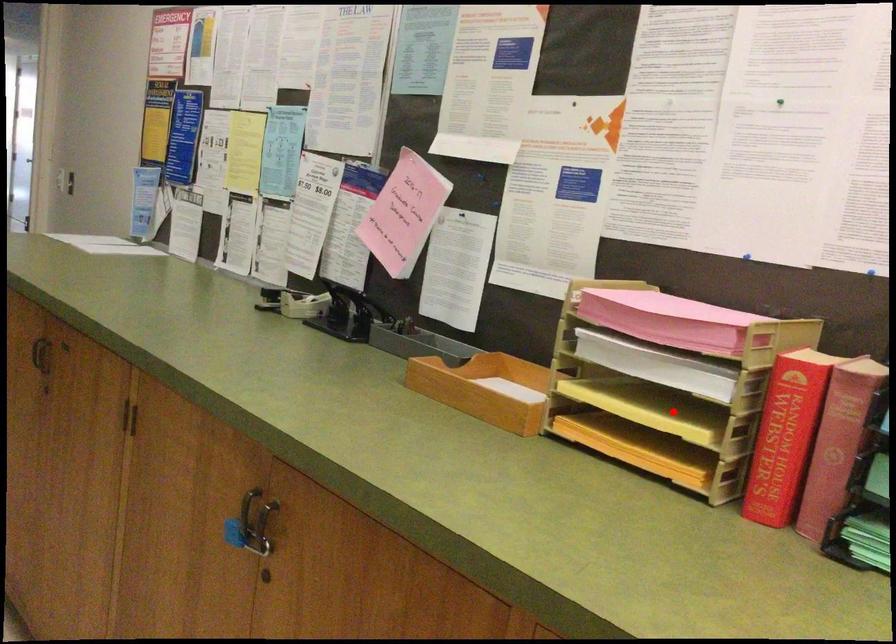
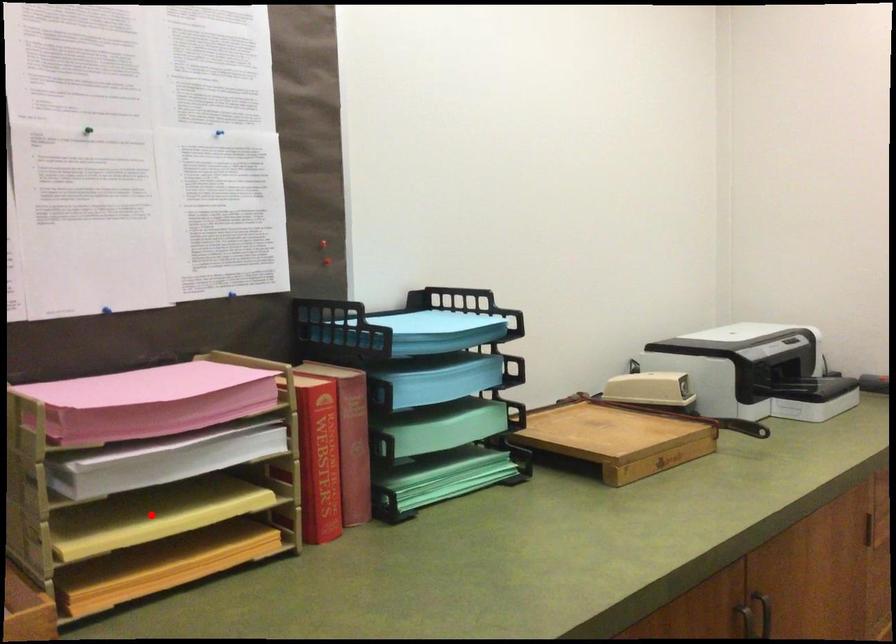
I am providing you with two images of the same scene from different viewpoints. A red point is marked on the first image and another point is marked on the second image. Does the point marked in image1 correspond to the same location as the one in image2?

Yes